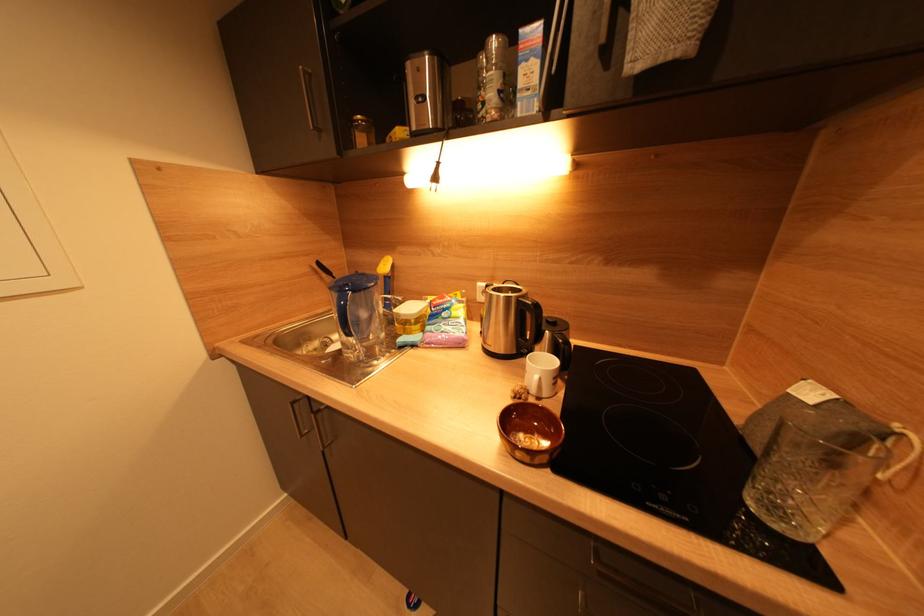
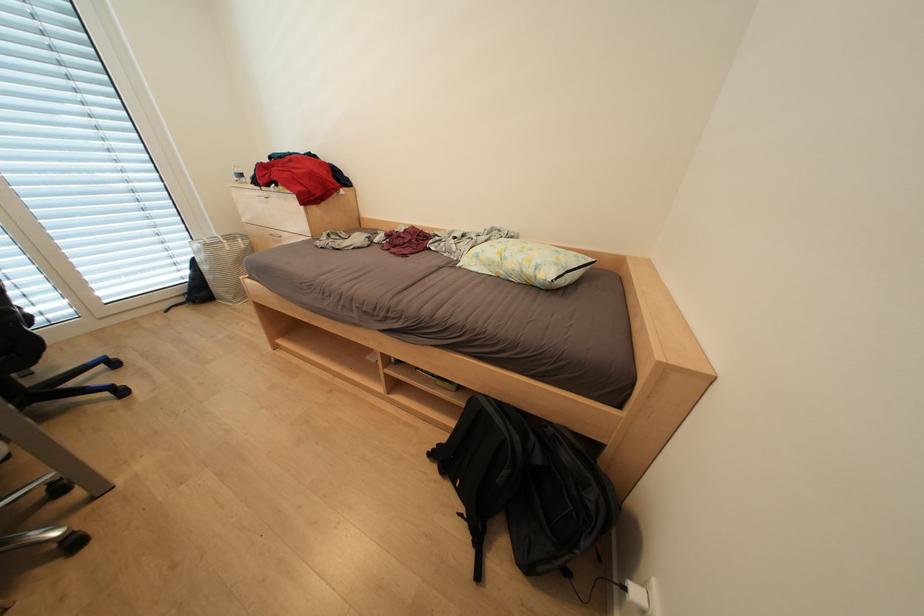
Question: Which direction would the cameraman need to move to produce the second image? Reply with the corresponding letter.

Choices:
 (A) Left
 (B) Right
 (C) Forward
 (D) Backward

Answer: (A)